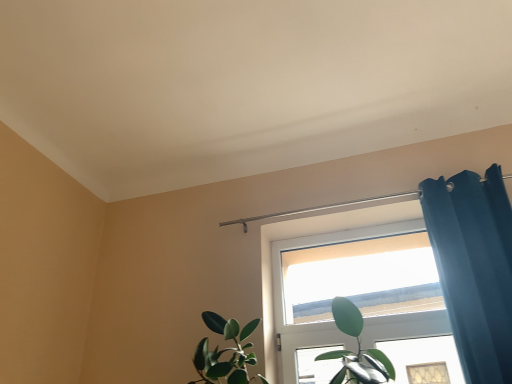
Question: Is teal velvet curtain at right completely or partially inside white matte window at upper center?

Choices:
 (A) yes
 (B) no

Answer: (B)

Question: From a real-world perspective, is white matte window at upper center on top of teal velvet curtain at right?

Choices:
 (A) yes
 (B) no

Answer: (A)

Question: Is white matte window at upper center thinner than teal velvet curtain at right?

Choices:
 (A) no
 (B) yes

Answer: (B)

Question: Is white matte window at upper center touching teal velvet curtain at right?

Choices:
 (A) yes
 (B) no

Answer: (B)

Question: Can you confirm if white matte window at upper center is positioned to the left of teal velvet curtain at right?

Choices:
 (A) yes
 (B) no

Answer: (A)

Question: Does white matte window at upper center have a lesser height compared to teal velvet curtain at right?

Choices:
 (A) yes
 (B) no

Answer: (A)

Question: From the image's perspective, would you say teal velvet curtain at right is shown under white matte window at upper center?

Choices:
 (A) yes
 (B) no

Answer: (B)

Question: Considering the relative positions of teal velvet curtain at right and white matte window at upper center in the image provided, is teal velvet curtain at right to the right of white matte window at upper center from the viewer's perspective?

Choices:
 (A) yes
 (B) no

Answer: (A)

Question: Is teal velvet curtain at right not near white matte window at upper center?

Choices:
 (A) yes
 (B) no

Answer: (B)

Question: Is the depth of teal velvet curtain at right greater than that of white matte window at upper center?

Choices:
 (A) no
 (B) yes

Answer: (A)

Question: Could you tell me if teal velvet curtain at right is facing white matte window at upper center?

Choices:
 (A) yes
 (B) no

Answer: (B)

Question: Is teal velvet curtain at right closer to the viewer compared to white matte window at upper center?

Choices:
 (A) yes
 (B) no

Answer: (A)

Question: Does point (290, 259) appear closer or farther from the camera than point (501, 289)?

Choices:
 (A) closer
 (B) farther

Answer: (B)